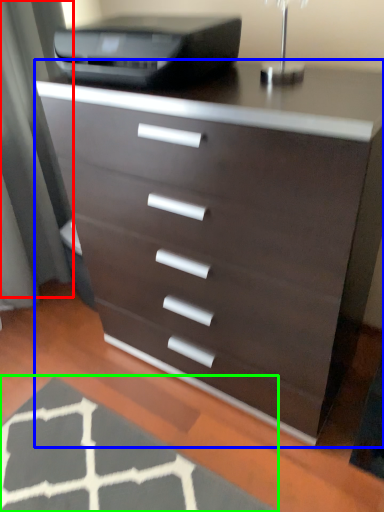
Question: Which object is the closest to the screen door (highlighted by a red box)? Choose among these: chest of drawers (highlighted by a blue box) or doormat (highlighted by a green box).

Choices:
 (A) chest of drawers
 (B) doormat

Answer: (A)